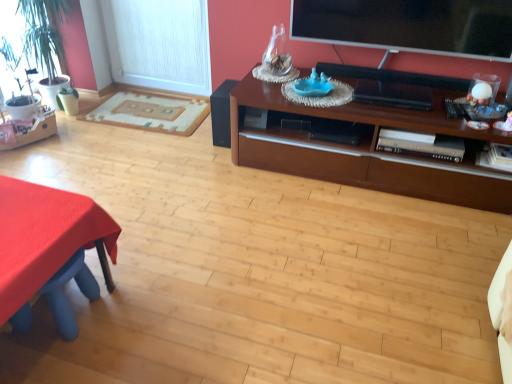
Question: Are beige woven rug at left and white textured window screen at left located far from each other?

Choices:
 (A) yes
 (B) no

Answer: (B)

Question: From the image's perspective, is beige woven rug at left under white textured window screen at left?

Choices:
 (A) yes
 (B) no

Answer: (A)

Question: Is white textured window screen at left a part of beige woven rug at left?

Choices:
 (A) yes
 (B) no

Answer: (B)

Question: Can you confirm if beige woven rug at left is bigger than white textured window screen at left?

Choices:
 (A) no
 (B) yes

Answer: (A)

Question: Is beige woven rug at left to the right of white textured window screen at left from the viewer's perspective?

Choices:
 (A) no
 (B) yes

Answer: (A)

Question: From a real-world perspective, relative to brown wood cabinet at upper right, is white textured window screen at left vertically above or below?

Choices:
 (A) below
 (B) above

Answer: (B)

Question: Considering the positions of point (144, 14) and point (266, 142), is point (144, 14) closer or farther from the camera than point (266, 142)?

Choices:
 (A) closer
 (B) farther

Answer: (B)

Question: Is white textured window screen at left taller or shorter than brown wood cabinet at upper right?

Choices:
 (A) short
 (B) tall

Answer: (B)

Question: Looking at the image, does white textured window screen at left seem bigger or smaller compared to brown wood cabinet at upper right?

Choices:
 (A) big
 (B) small

Answer: (B)

Question: Is brown wood cabinet at upper right in front of or behind red fabric table at lower left in the image?

Choices:
 (A) front
 (B) behind

Answer: (B)

Question: From a real-world perspective, is brown wood cabinet at upper right positioned above or below red fabric table at lower left?

Choices:
 (A) above
 (B) below

Answer: (B)

Question: Is brown wood cabinet at upper right wider or thinner than red fabric table at lower left?

Choices:
 (A) thin
 (B) wide

Answer: (A)

Question: Does point (298, 117) appear closer or farther from the camera than point (36, 188)?

Choices:
 (A) closer
 (B) farther

Answer: (B)

Question: Is beige woven rug at left spatially inside flat screen tv at upper right, or outside of it?

Choices:
 (A) inside
 (B) outside

Answer: (B)

Question: From a real-world perspective, is beige woven rug at left positioned above or below flat screen tv at upper right?

Choices:
 (A) above
 (B) below

Answer: (B)